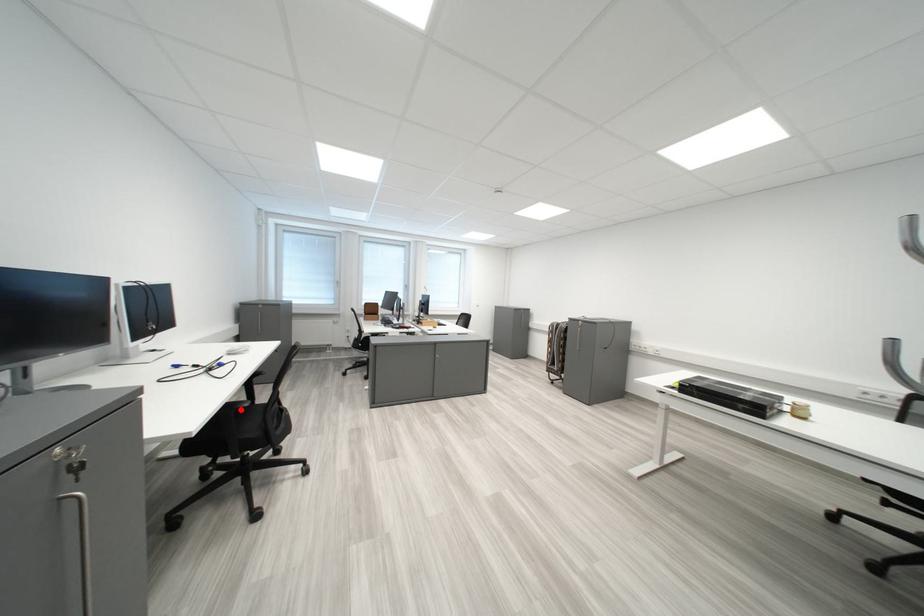
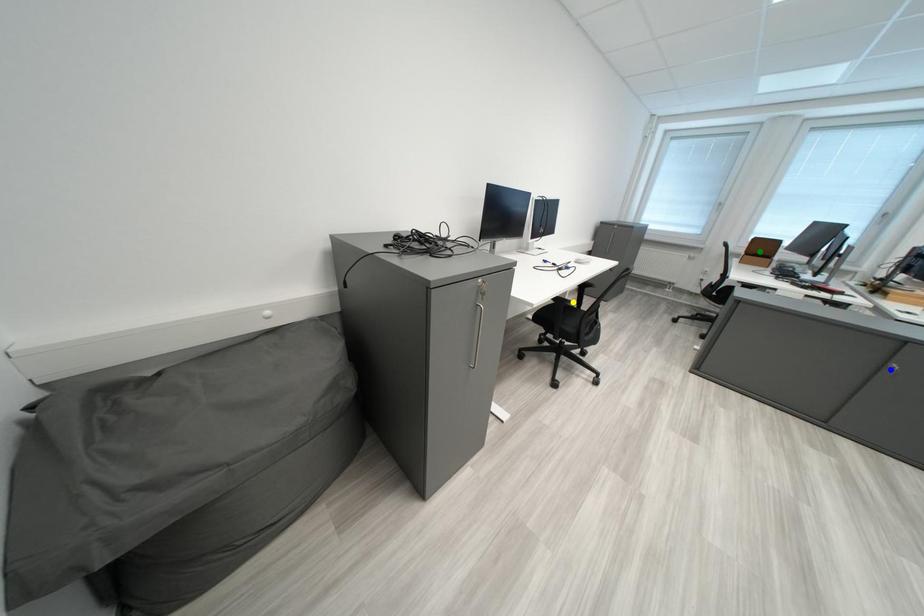
Question: I am providing you with two images of the same scene from different viewpoints. A red point is marked on the first image. You are given multiple points on the second image. Which point in image 2 represents the same 3d spot as the red point in image 1?

Choices:
 (A) blue point
 (B) green point
 (C) yellow point

Answer: (C)